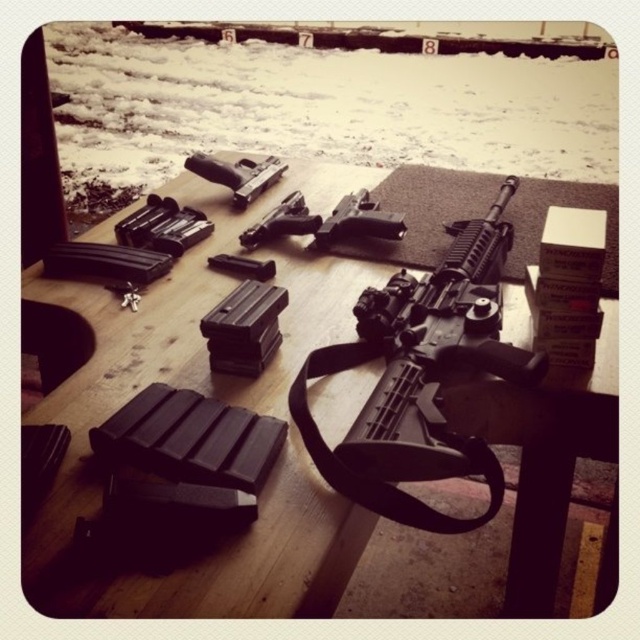
What do you see at coordinates (220, 397) in the screenshot?
I see `black matte picnic table at center` at bounding box center [220, 397].

Locate an element on the screen. black matte picnic table at center is located at coordinates (220, 397).